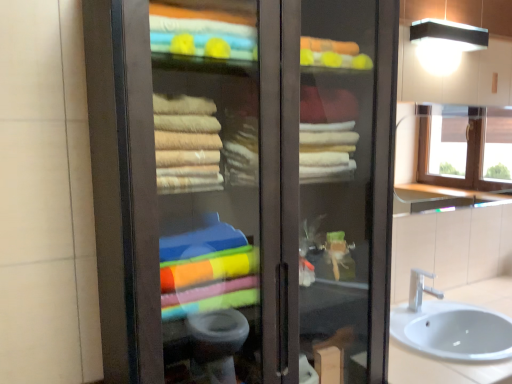
At what (x,y) coordinates should I click in order to perform the action: click on vacant area that lies to the right of silver metallic faucet at lower right. Please return your answer as a coordinate pair (x, y). Looking at the image, I should click on (463, 311).